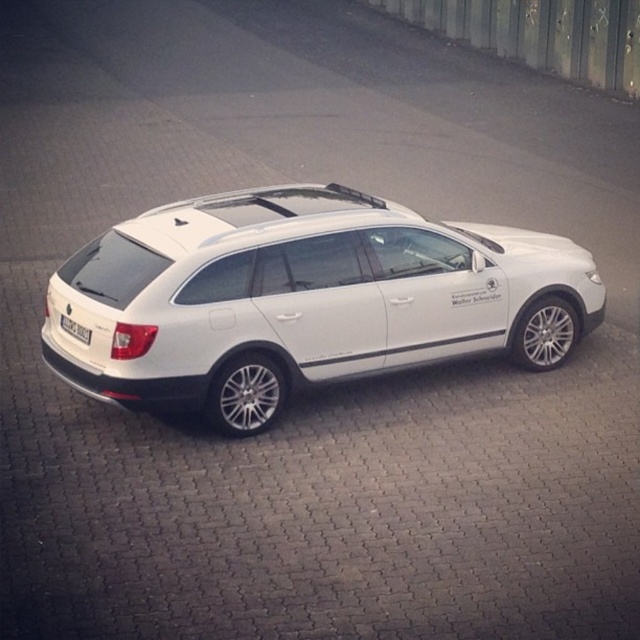
Question: In this image, where is white metallic car at center located relative to white plastic license plate at lower left?

Choices:
 (A) below
 (B) above

Answer: (B)

Question: Which point is closer to the camera taking this photo?

Choices:
 (A) (68, 321)
 (B) (212, 385)

Answer: (B)

Question: Can you confirm if white metallic car at center is positioned to the right of white plastic license plate at lower left?

Choices:
 (A) yes
 (B) no

Answer: (A)

Question: Does white metallic car at center have a greater width compared to white plastic license plate at lower left?

Choices:
 (A) no
 (B) yes

Answer: (B)